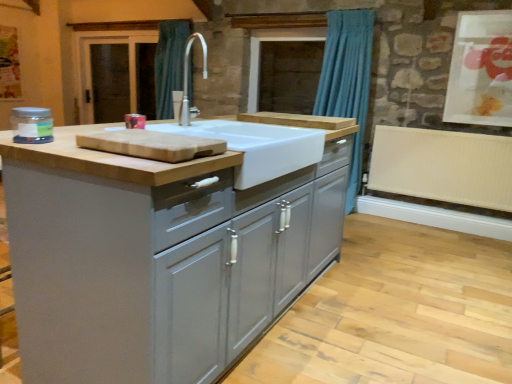
Question: From a real-world perspective, is blue fabric curtain at upper center positioned above or below matte gray cabinets at center?

Choices:
 (A) above
 (B) below

Answer: (A)

Question: In the image, is blue fabric curtain at upper center positioned in front of or behind matte gray cabinets at center?

Choices:
 (A) front
 (B) behind

Answer: (B)

Question: Based on their relative distances, which object is nearer to the white ribbed radiator at lower right?

Choices:
 (A) matte gray cabinets at center
 (B) white ceramic sink at center
 (C) brown wooden screen door at left
 (D) matte glass jar at left
 (E) matte paper artwork at upper right

Answer: (E)

Question: Based on their relative distances, which object is nearer to the matte gray cabinets at center?

Choices:
 (A) brown wooden screen door at left
 (B) matte paper artwork at upper right
 (C) blue fabric curtain at upper center
 (D) white ribbed radiator at lower right
 (E) white ceramic sink at center

Answer: (E)